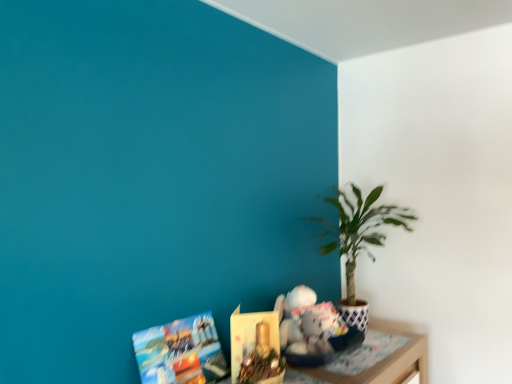
Question: Considering the relative sizes of matte paper book at lower left, the 1th book when ordered from left to right, and green leafy plant at right in the image provided, is matte paper book at lower left, the 1th book when ordered from left to right, thinner than green leafy plant at right?

Choices:
 (A) no
 (B) yes

Answer: (B)

Question: Can you confirm if matte paper book at lower left, arranged as the second book when viewed from the right, is shorter than green leafy plant at right?

Choices:
 (A) yes
 (B) no

Answer: (A)

Question: Considering the relative positions of matte paper book at lower left, arranged as the second book when viewed from the right, and green leafy plant at right in the image provided, is matte paper book at lower left, arranged as the second book when viewed from the right, in front of green leafy plant at right?

Choices:
 (A) yes
 (B) no

Answer: (A)

Question: From the image's perspective, does matte paper book at lower left, the 1th book when ordered from left to right, appear lower than green leafy plant at right?

Choices:
 (A) yes
 (B) no

Answer: (A)

Question: Does matte paper book at lower left, arranged as the second book when viewed from the right, contain green leafy plant at right?

Choices:
 (A) yes
 (B) no

Answer: (B)

Question: In the image, is green leafy plant at right on the left side or the right side of wooden table at lower right?

Choices:
 (A) right
 (B) left

Answer: (A)

Question: From the image's perspective, is green leafy plant at right above or below wooden table at lower right?

Choices:
 (A) below
 (B) above

Answer: (B)

Question: From a real-world perspective, relative to wooden table at lower right, is green leafy plant at right vertically above or below?

Choices:
 (A) above
 (B) below

Answer: (A)

Question: Is green leafy plant at right in front of or behind wooden table at lower right in the image?

Choices:
 (A) behind
 (B) front

Answer: (A)

Question: Is green leafy plant at right to the left or to the right of matte paper book at lower center, the first book positioned from the right, in the image?

Choices:
 (A) right
 (B) left

Answer: (A)

Question: In the image, is green leafy plant at right positioned in front of or behind matte paper book at lower center, which is the 2th book from left to right?

Choices:
 (A) behind
 (B) front

Answer: (A)

Question: From the image's perspective, is green leafy plant at right above or below matte paper book at lower center, the first book positioned from the right?

Choices:
 (A) below
 (B) above

Answer: (B)

Question: Looking at their shapes, would you say green leafy plant at right is wider or thinner than matte paper book at lower center, the first book positioned from the right?

Choices:
 (A) wide
 (B) thin

Answer: (A)

Question: Considering the positions of wooden table at lower right and matte paper book at lower left, the 1th book when ordered from left to right, in the image, is wooden table at lower right bigger or smaller than matte paper book at lower left, the 1th book when ordered from left to right,?

Choices:
 (A) big
 (B) small

Answer: (B)

Question: In the image, is wooden table at lower right on the left side or the right side of matte paper book at lower left, the 1th book when ordered from left to right?

Choices:
 (A) left
 (B) right

Answer: (B)